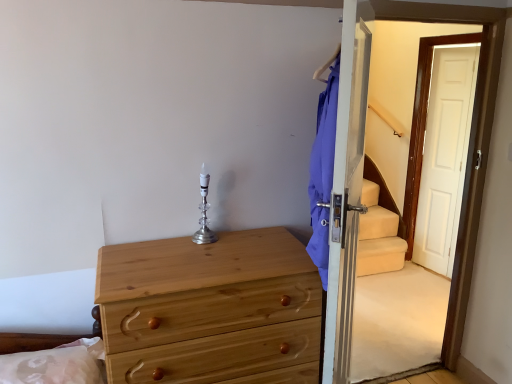
Question: From the image's perspective, is natural wood chest of drawers at lower left located above silver/crystal candle holder at center?

Choices:
 (A) no
 (B) yes

Answer: (A)

Question: Is natural wood chest of drawers at lower left turned away from silver/crystal candle holder at center?

Choices:
 (A) no
 (B) yes

Answer: (A)

Question: Is natural wood chest of drawers at lower left to the left of silver/crystal candle holder at center from the viewer's perspective?

Choices:
 (A) no
 (B) yes

Answer: (A)

Question: Does natural wood chest of drawers at lower left turn towards silver/crystal candle holder at center?

Choices:
 (A) no
 (B) yes

Answer: (A)

Question: Does natural wood chest of drawers at lower left have a greater height compared to silver/crystal candle holder at center?

Choices:
 (A) no
 (B) yes

Answer: (B)

Question: Looking at the image, does silver/crystal candle holder at center seem bigger or smaller compared to transparent glass screen door at right?

Choices:
 (A) small
 (B) big

Answer: (A)

Question: From the image's perspective, is silver/crystal candle holder at center above or below transparent glass screen door at right?

Choices:
 (A) above
 (B) below

Answer: (A)

Question: Does point (203, 226) appear closer or farther from the camera than point (364, 296)?

Choices:
 (A) farther
 (B) closer

Answer: (B)

Question: Is silver/crystal candle holder at center in front of or behind transparent glass screen door at right in the image?

Choices:
 (A) behind
 (B) front

Answer: (A)

Question: Is natural wood chest of drawers at lower left taller or shorter than silver/crystal candle holder at center?

Choices:
 (A) tall
 (B) short

Answer: (A)

Question: From the image's perspective, is natural wood chest of drawers at lower left located above or below silver/crystal candle holder at center?

Choices:
 (A) below
 (B) above

Answer: (A)

Question: Does point (250, 307) appear closer or farther from the camera than point (200, 187)?

Choices:
 (A) farther
 (B) closer

Answer: (B)

Question: From a real-world perspective, is natural wood chest of drawers at lower left physically located above or below silver/crystal candle holder at center?

Choices:
 (A) above
 (B) below

Answer: (B)

Question: Is transparent glass screen door at right situated inside natural wood chest of drawers at lower left or outside?

Choices:
 (A) outside
 (B) inside

Answer: (A)

Question: In terms of width, does transparent glass screen door at right look wider or thinner when compared to natural wood chest of drawers at lower left?

Choices:
 (A) wide
 (B) thin

Answer: (B)